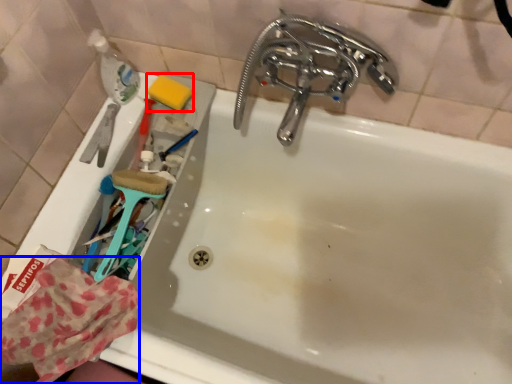
Question: Which object appears closest to the camera in this image, soap (highlighted by a red box) or material (highlighted by a blue box)?

Choices:
 (A) soap
 (B) material

Answer: (B)